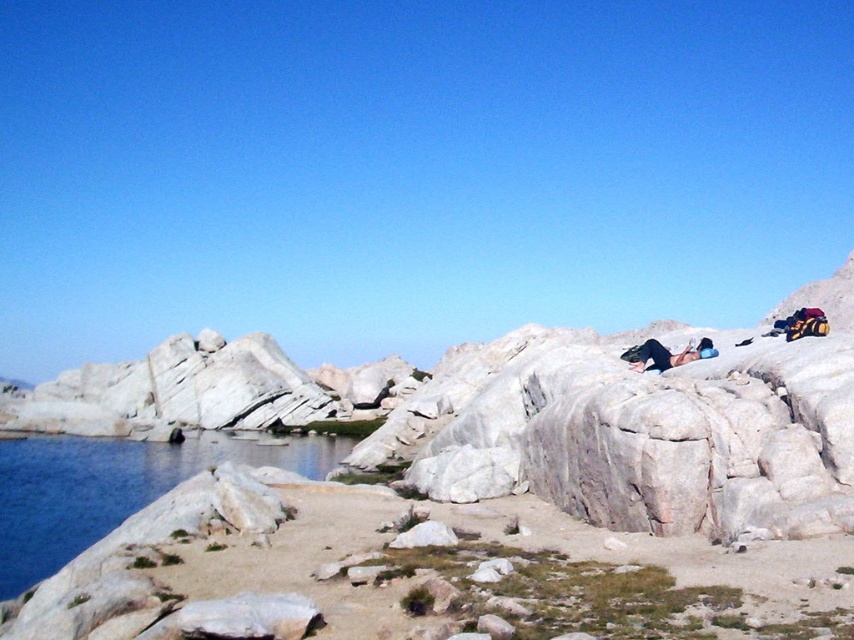
You are standing on the rocky terrain and want to reach the blue smooth water at lower left. There is a black fabric person at center blocking your path. Can you walk around them to reach the water?

The blue smooth water at lower left is taller than the black fabric person at center, so you can walk around the black fabric person at center to reach the blue smooth water at lower left since the water is elevated compared to the person.

You are standing on the rocky terrain and want to cross to the water. There is a blue smooth water at lower left and a black fabric person at center in your way. Which object is larger in size that you need to be cautious about?

The blue smooth water at lower left is bigger than the black fabric person at center, so you should be cautious about the blue smooth water at lower left as it is larger in size.